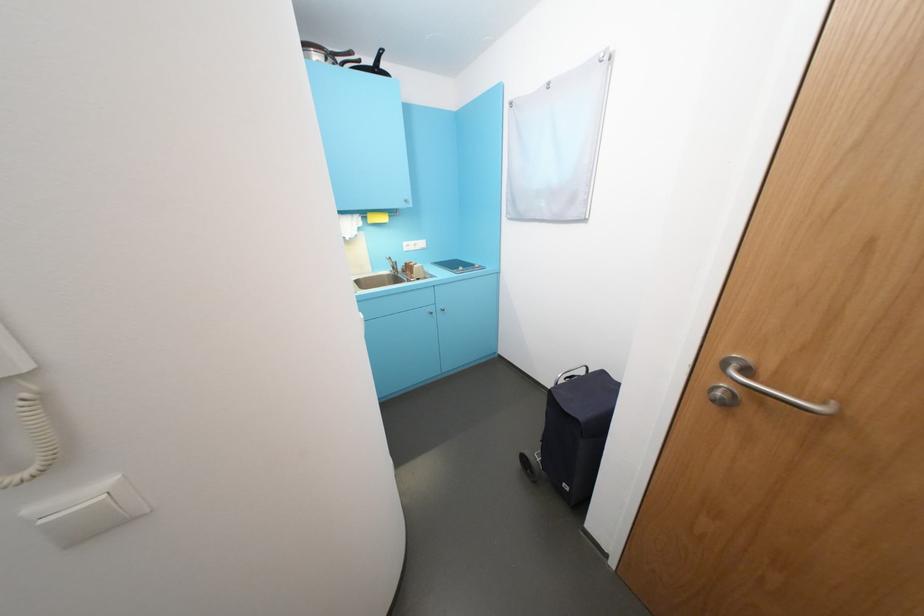
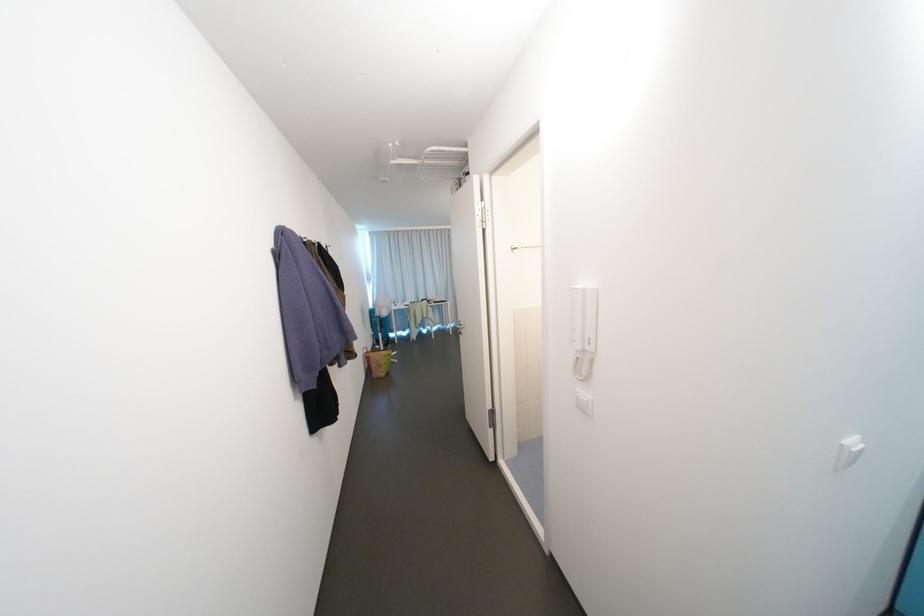
First-person continuous shooting, in which direction is the camera rotating?

The camera's rotation is toward left-down.